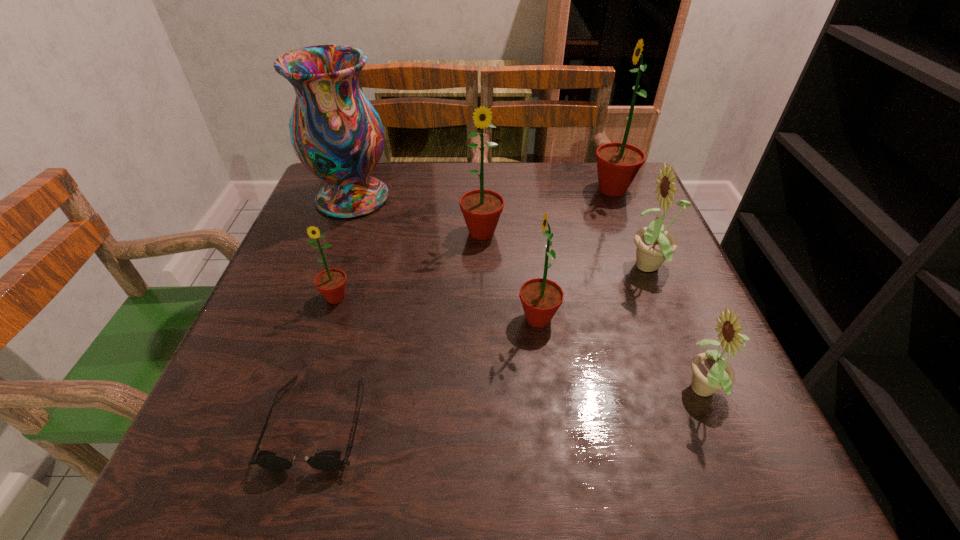
Where is `the biggest green sunflower`? the biggest green sunflower is located at coordinates (617, 163).

At what (x,y) coordinates should I click in order to perform the action: click on the farthest green sunflower. Please return your answer as a coordinate pair (x, y). The height and width of the screenshot is (540, 960). Looking at the image, I should click on (617, 163).

Locate an element on the screen. The height and width of the screenshot is (540, 960). vase is located at coordinates (x=337, y=134).

Where is `the second green sunflower from left to right`? the second green sunflower from left to right is located at coordinates (481, 208).

Identify the location of the fourth object from left to right. (481, 208).

The image size is (960, 540). Identify the location of the farther yellow sunflower. (654, 244).

The width and height of the screenshot is (960, 540). Identify the location of the third biggest green sunflower. (540, 297).

The image size is (960, 540). I want to click on the third sunflower from left to right, so click(x=540, y=297).

Image resolution: width=960 pixels, height=540 pixels. Identify the location of the nearest sunflower. (711, 373).

Identify the location of the nearer yellow sunflower. pos(711,373).